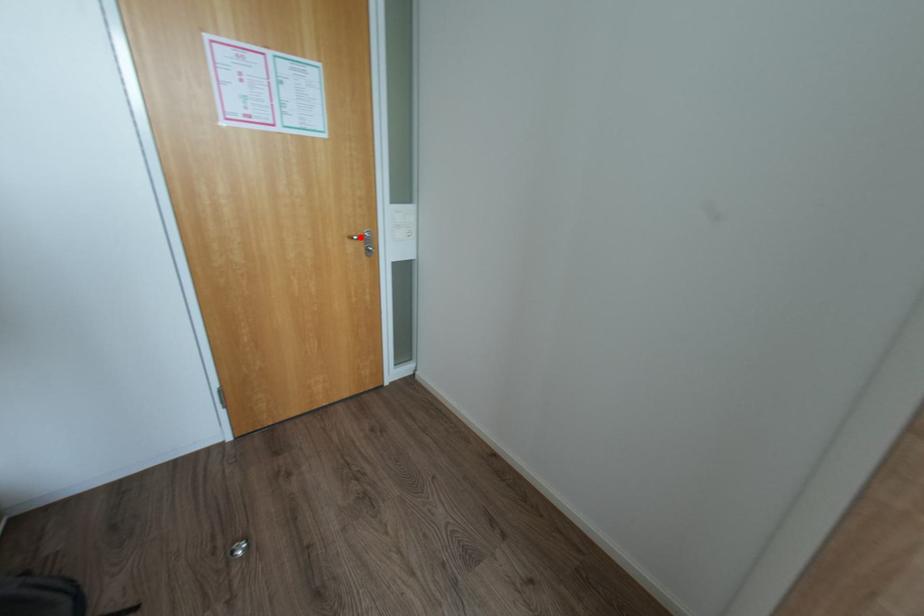
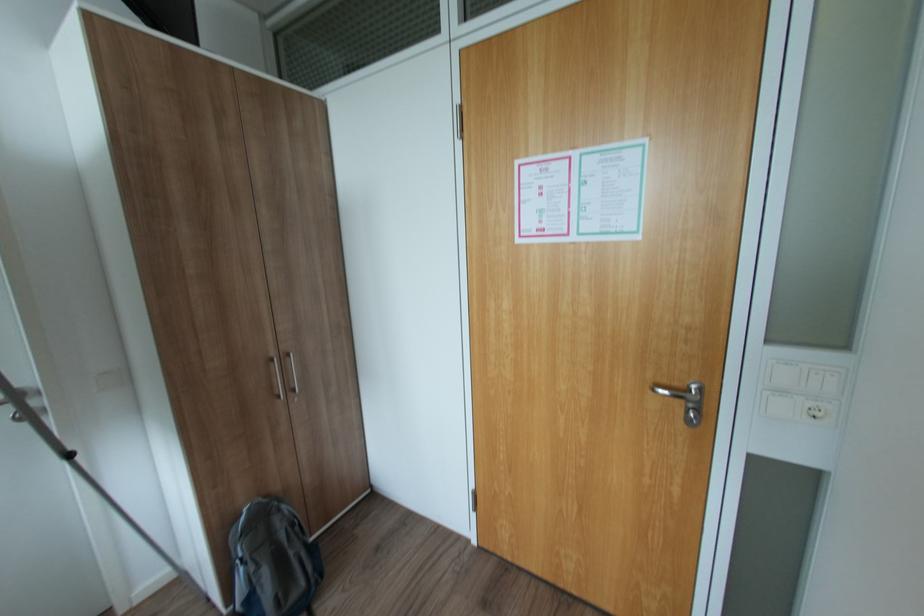
Locate, in the second image, the point that corresponds to the highlighted location in the first image.

(664, 390)